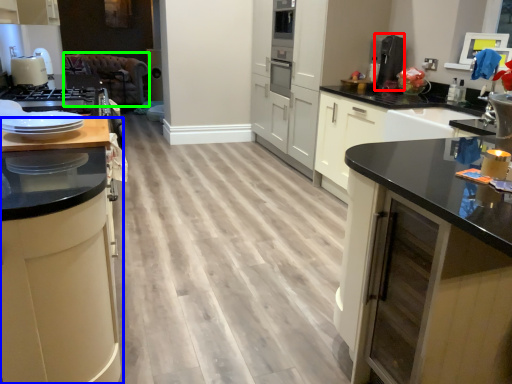
Question: Estimate the real-world distances between objects in this image. Which object is closer to coffee machine (highlighted by a red box), cabinetry (highlighted by a blue box) or brown (highlighted by a green box)?

Choices:
 (A) cabinetry
 (B) brown

Answer: (A)